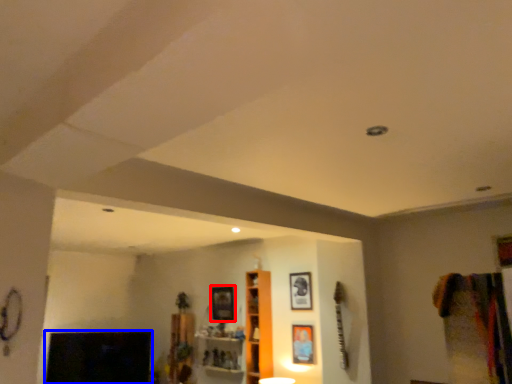
Question: Which object is further to the camera taking this photo, picture frame (highlighted by a red box) or fireplace (highlighted by a blue box)?

Choices:
 (A) picture frame
 (B) fireplace

Answer: (B)